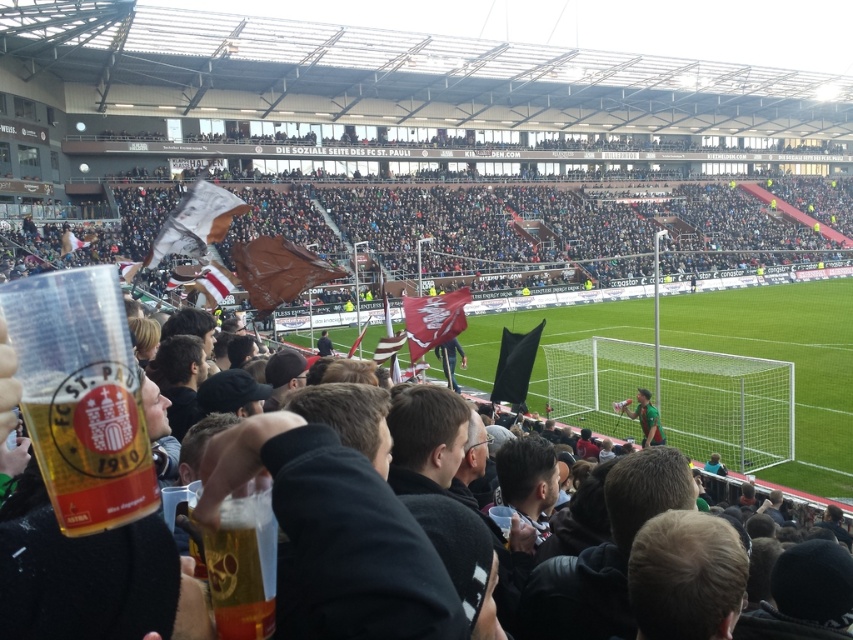
What are the coordinates of `dark brown fabric at upper center` in the screenshot? It's located at (532, 230).

Which is in front, point (397, 208) or point (659, 422)?

Point (659, 422) is in front.

You are a GUI agent. You are given a task and a screenshot of the screen. Output one action in this format:
    pyautogui.click(x=<x>, y=<y>)
    Task: Click on the dark brown fabric at upper center
    This screenshot has width=853, height=640.
    Given the screenshot: What is the action you would take?
    pyautogui.click(x=532, y=230)

Find the location of a particular element. The image size is (853, 640). green grass football field at center is located at coordinates (786, 358).

The image size is (853, 640). I want to click on green grass football field at center, so click(x=786, y=358).

Who is taller, green grass football field at center or green jersey at center?

With more height is green grass football field at center.

Can you confirm if green grass football field at center is positioned below green jersey at center?

No.

Image resolution: width=853 pixels, height=640 pixels. Describe the element at coordinates (786, 358) in the screenshot. I see `green grass football field at center` at that location.

The height and width of the screenshot is (640, 853). Find the location of `green grass football field at center`. green grass football field at center is located at coordinates (786, 358).